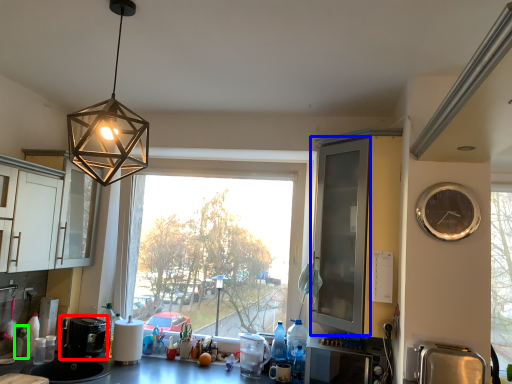
Question: Which object is the farthest from coffee machine (highlighted by a red box)? Choose among these: screen door (highlighted by a blue box) or bottle (highlighted by a green box).

Choices:
 (A) screen door
 (B) bottle

Answer: (A)